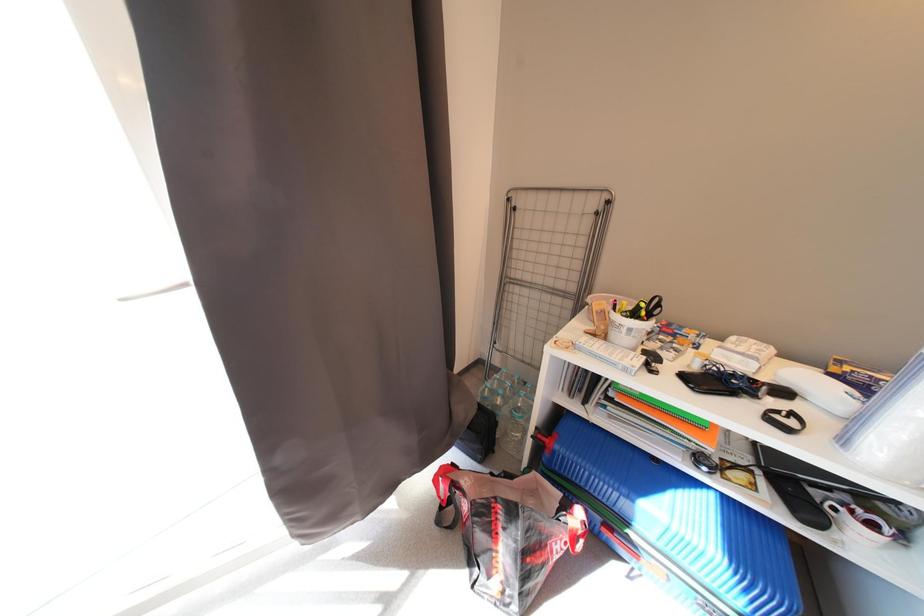
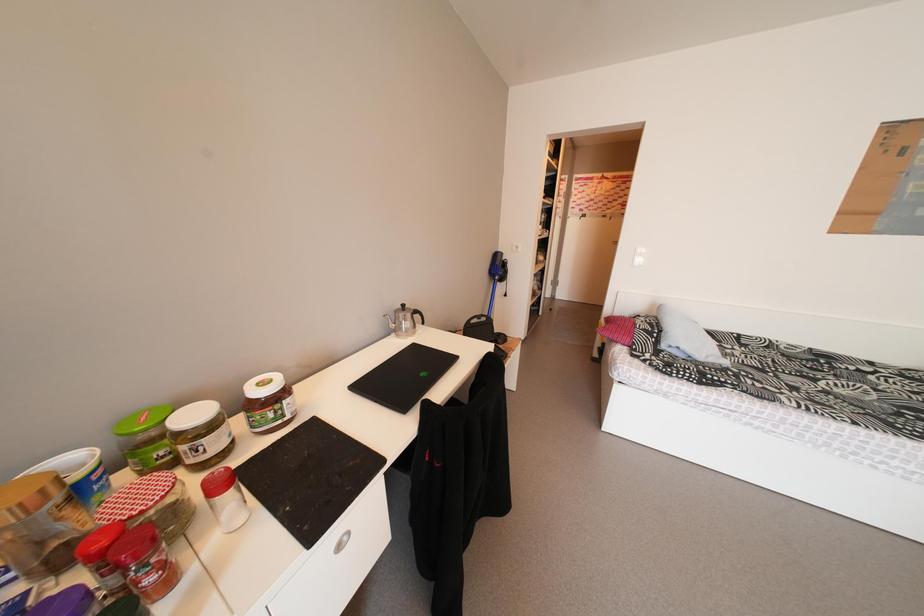
How did the camera likely rotate?

The camera rotated toward right-down.